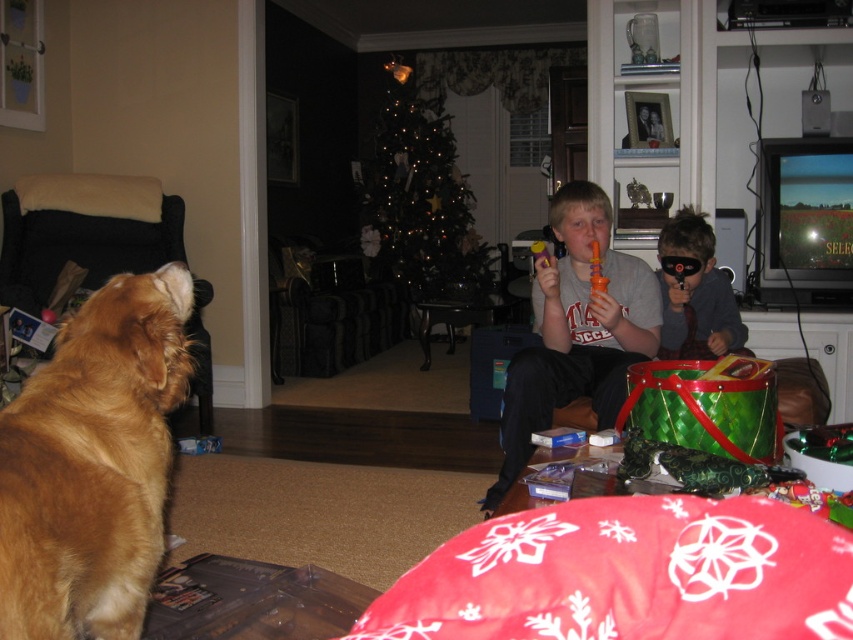
You are a guest in this living room and want to sit down between the golden fur dog at left and the illuminated glass christmas tree at center. Is there enough space for you to sit comfortably?

The golden fur dog at left is narrower than the illuminated glass christmas tree at center, so there should be sufficient space between them for you to sit comfortably.

You are a guest in this living room and want to place a new rectangular rug that is 1 meter wide between the golden fur dog at left and the matte plastic toy at center. Can the rug fit between them without overlapping either object?

The golden fur dog at left is narrower than the matte plastic toy at center. Since the rug is 1 meter wide, it can fit between them as long as the space between the dog and the toy is at least 1 meter wide. However, the exact placement depends on their current separation distance, which isn not specified in the provided information.